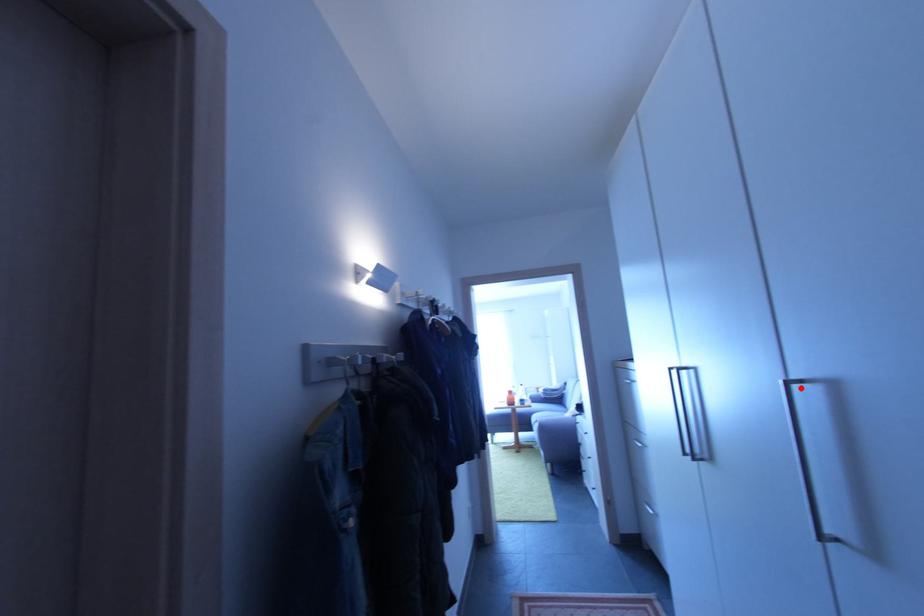
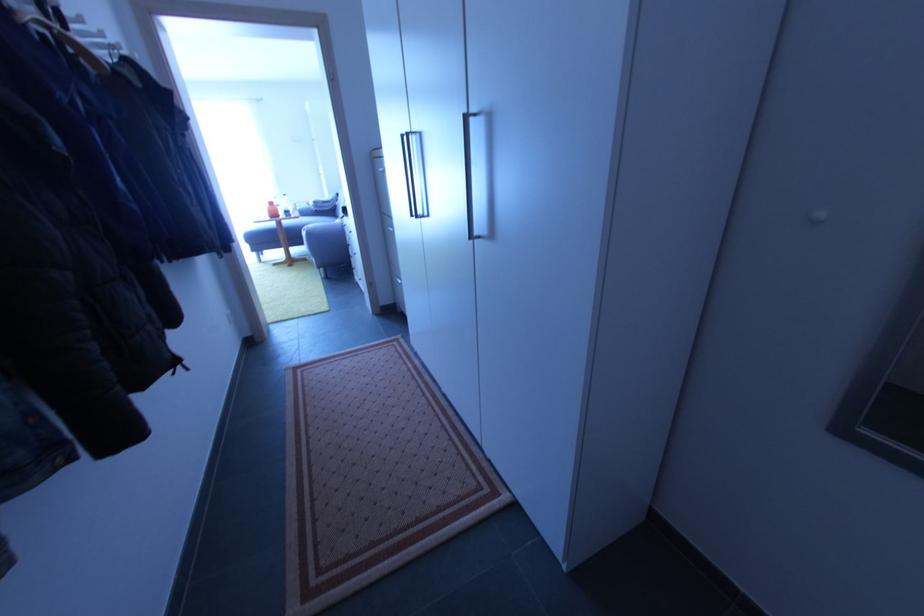
Find the pixel in the second image that matches the highlighted location in the first image.

(476, 122)